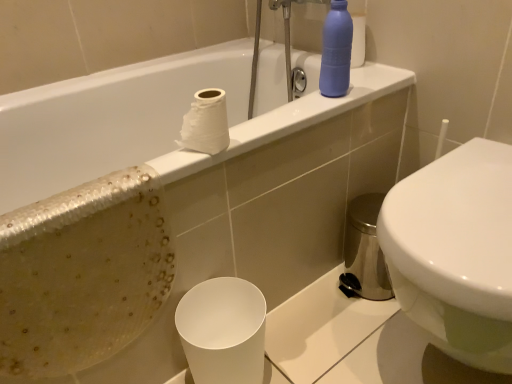
Where is `vacant position to the left of matte blue bottle at upper right`? This screenshot has width=512, height=384. vacant position to the left of matte blue bottle at upper right is located at coordinates (290, 110).